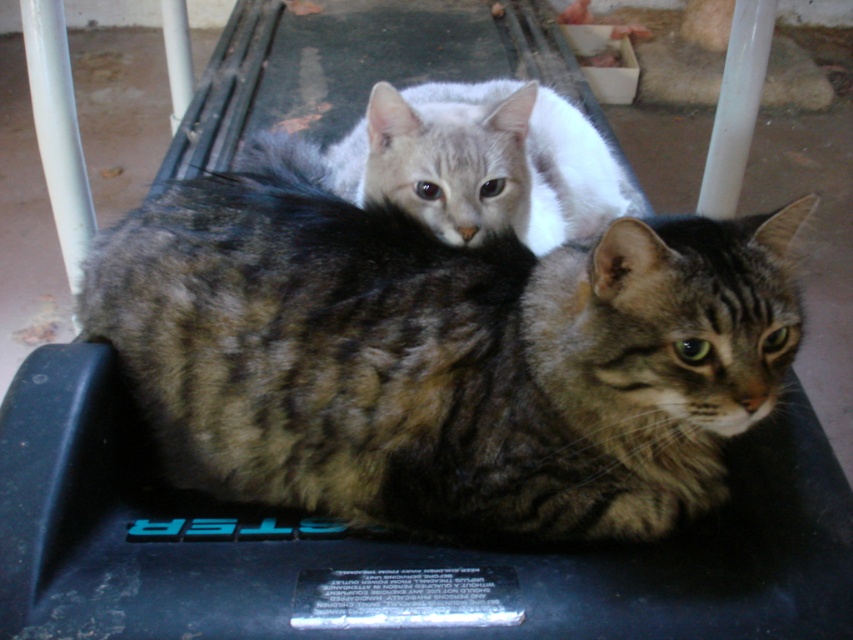
You are a cat owner who wants to ensure both cats can comfortably rest on the treadmill without overcrowding. Given that the treadmill surface is 36 inches wide, can both the tabby fur cat at center and the gray fur cat at center fit side by side without overlapping?

The distance between the tabby fur cat at center and the gray fur cat at center is 13.72 inches. Since the treadmill is 36 inches wide, there is sufficient space for both cats to fit side by side without overlapping, as 13.72 inches is less than half of 36 inches.

You are a photographer setting up for a cat photo shoot. You need to ensure that both the tabby fur cat at center and the gray fur cat at center are clearly visible in the photo. Based on their positions, which cat might be partially obscured and why?

The gray fur cat at center might be partially obscured because the tabby fur cat at center is positioned under it, potentially blocking part of the gray cat from view.

You are a photographer trying to capture both cats in the scene. Since you want to ensure both cats are in the frame, which direction should you move your camera to the left or right relative to the tabby fur cat at center and gray fur cat at center?

The tabby fur cat at center is positioned on the left side of gray fur cat at center. To include both cats in the frame, move the camera to the right so that it captures the tabby fur cat at center on the left and the gray fur cat at center on the right.